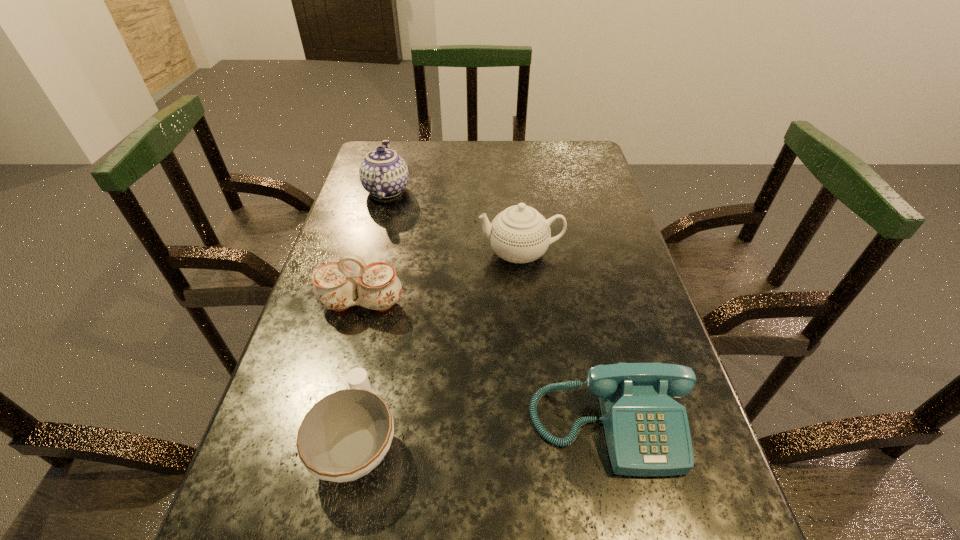
Identify the location of the fourth nearest object. (520, 234).

At what (x,y) coordinates should I click in order to perform the action: click on the rightmost chinaware. Please return your answer as a coordinate pair (x, y). Looking at the image, I should click on (520, 234).

This screenshot has width=960, height=540. In order to click on the third farthest chinaware in this screenshot , I will do `click(377, 286)`.

This screenshot has height=540, width=960. What are the coordinates of `the farthest chinaware` in the screenshot? It's located at (383, 173).

This screenshot has width=960, height=540. What are the coordinates of `telephone` in the screenshot? It's located at (647, 432).

At what (x,y) coordinates should I click in order to perform the action: click on the nearest chinaware. Please return your answer as a coordinate pair (x, y). Looking at the image, I should click on coord(344,436).

Where is `the shortest object`? the shortest object is located at coordinates (344, 436).

Where is `free space located 0.230m on the spout of the fourth nearest object`? This screenshot has height=540, width=960. free space located 0.230m on the spout of the fourth nearest object is located at coordinates (386, 253).

Find the location of a particular element. This screenshot has height=540, width=960. free space located 0.240m on the spout of the fourth nearest object is located at coordinates (382, 253).

You are a GUI agent. You are given a task and a screenshot of the screen. Output one action in this format:
    pyautogui.click(x=<x>, y=<y>)
    Task: Click on the free space located on the spout of the fourth nearest object
    Image resolution: width=960 pixels, height=540 pixels.
    Given the screenshot: What is the action you would take?
    pyautogui.click(x=378, y=253)